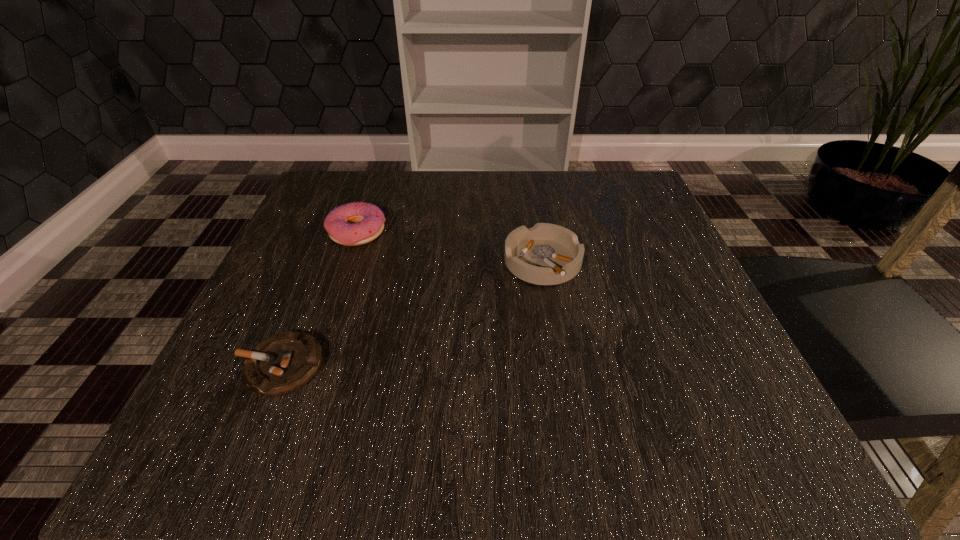
The height and width of the screenshot is (540, 960). Find the location of `vacant space that satisfies the following two spatial constraints: 1. on the back side of the doughnut; 2. on the left side of the shorter ashtray`. vacant space that satisfies the following two spatial constraints: 1. on the back side of the doughnut; 2. on the left side of the shorter ashtray is located at coordinates (336, 233).

Where is `vacant region that satisfies the following two spatial constraints: 1. on the back side of the nearest object; 2. on the right side of the farther ashtray`? vacant region that satisfies the following two spatial constraints: 1. on the back side of the nearest object; 2. on the right side of the farther ashtray is located at coordinates (324, 262).

Find the location of `vacant region that satisfies the following two spatial constraints: 1. on the back side of the left ashtray; 2. on the right side of the farther ashtray`. vacant region that satisfies the following two spatial constraints: 1. on the back side of the left ashtray; 2. on the right side of the farther ashtray is located at coordinates (x=324, y=262).

Locate an element on the screen. vacant space that satisfies the following two spatial constraints: 1. on the back side of the shortest object; 2. on the left side of the doughnut is located at coordinates (336, 233).

At what (x,y) coordinates should I click in order to perform the action: click on free space that satisfies the following two spatial constraints: 1. on the back side of the shortest object; 2. on the right side of the doughnut. Please return your answer as a coordinate pair (x, y). Looking at the image, I should click on (336, 233).